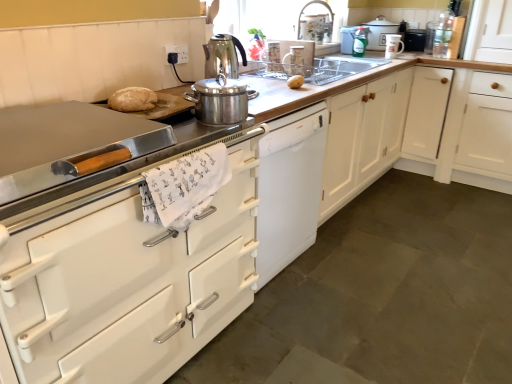
Identify the location of vacant area that is in front of white ceramic mug at upper right, the 3th kitchen appliance from the back. The image size is (512, 384). (395, 56).